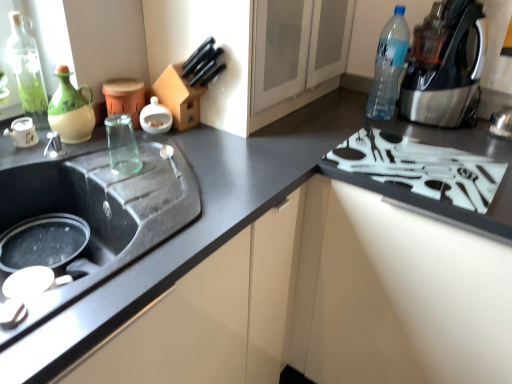
You are a GUI agent. You are given a task and a screenshot of the screen. Output one action in this format:
    pyautogui.click(x=<x>, y=<y>)
    Task: Click on the free space behind white plastic gas stove at right
    The height and width of the screenshot is (384, 512).
    Given the screenshot: What is the action you would take?
    pyautogui.click(x=366, y=119)